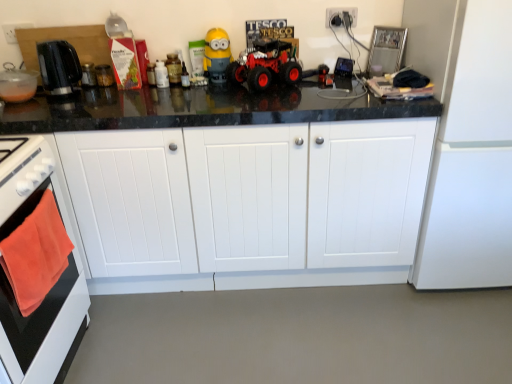
Question: Is white matte refrigerator at right surrounding black plastic kettle at left?

Choices:
 (A) no
 (B) yes

Answer: (A)

Question: Can you confirm if white matte refrigerator at right is positioned to the right of black plastic kettle at left?

Choices:
 (A) no
 (B) yes

Answer: (B)

Question: Is white matte refrigerator at right bigger than black plastic kettle at left?

Choices:
 (A) no
 (B) yes

Answer: (B)

Question: Is white matte refrigerator at right positioned behind black plastic kettle at left?

Choices:
 (A) no
 (B) yes

Answer: (A)

Question: Is white matte refrigerator at right to the left of black plastic kettle at left from the viewer's perspective?

Choices:
 (A) yes
 (B) no

Answer: (B)

Question: Looking at the image, does yellow matte minion at center seem bigger or smaller compared to white wood cabinets at center?

Choices:
 (A) small
 (B) big

Answer: (A)

Question: Is point (220, 61) closer or farther from the camera than point (110, 236)?

Choices:
 (A) farther
 (B) closer

Answer: (A)

Question: From their relative heights in the image, would you say yellow matte minion at center is taller or shorter than white wood cabinets at center?

Choices:
 (A) tall
 (B) short

Answer: (B)

Question: Would you say yellow matte minion at center is inside or outside white wood cabinets at center?

Choices:
 (A) inside
 (B) outside

Answer: (B)

Question: Is yellow matte minion at center to the left or to the right of black plastic kettle at left in the image?

Choices:
 (A) left
 (B) right

Answer: (B)

Question: Is yellow matte minion at center wider or thinner than black plastic kettle at left?

Choices:
 (A) thin
 (B) wide

Answer: (A)

Question: From a real-world perspective, is yellow matte minion at center above or below black plastic kettle at left?

Choices:
 (A) below
 (B) above

Answer: (A)

Question: Considering their positions, is yellow matte minion at center located in front of or behind black plastic kettle at left?

Choices:
 (A) front
 (B) behind

Answer: (B)

Question: Is point (216, 59) closer or farther from the camera than point (228, 69)?

Choices:
 (A) farther
 (B) closer

Answer: (B)

Question: Relative to rubberized red toy car at center, is yellow matte minion at center in front or behind?

Choices:
 (A) front
 (B) behind

Answer: (B)